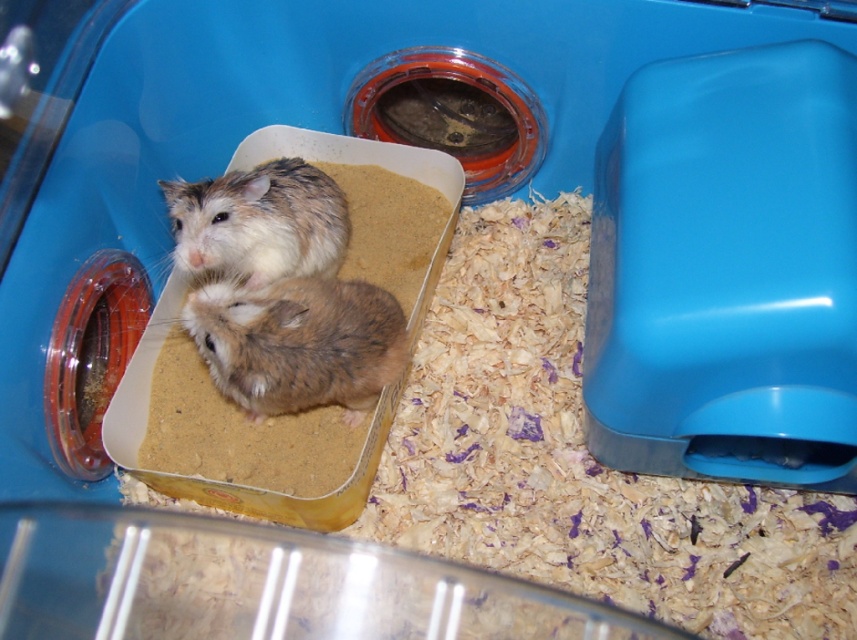
You are a small pet mouse that can jump up to 1 meter high. You are currently at the point marked as point (x=225, y=284). There is a tasty cracker placed at another point. Can you jump to reach the cracker?

The distance between the two points is 1.17 meters, which is beyond your jumping ability of 1 meter. Therefore, you cannot reach the cracker.

You are a small toy that needs to fit between the fuzzy brown mouse at center and the fuzzy brown hamster at center in the hamster cage. If the toy is 5 inches long, will it fit between them?

The distance between the fuzzy brown mouse at center and the fuzzy brown hamster at center is 4.67 inches, so the 5 inch toy will not fit between them as it is slightly longer than the available space.

You are a veterinarian examining a hamster cage. You notice two small rodents inside. Which one is bigger, the fuzzy brown mouse at center or the fuzzy brown hamster at center?

The fuzzy brown mouse at center is larger in size than the fuzzy brown hamster at center.